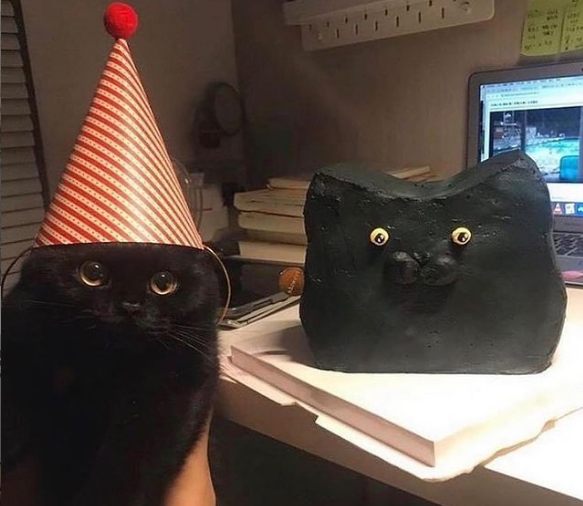
Where is `laptop`? The width and height of the screenshot is (583, 506). laptop is located at coordinates (568, 224).